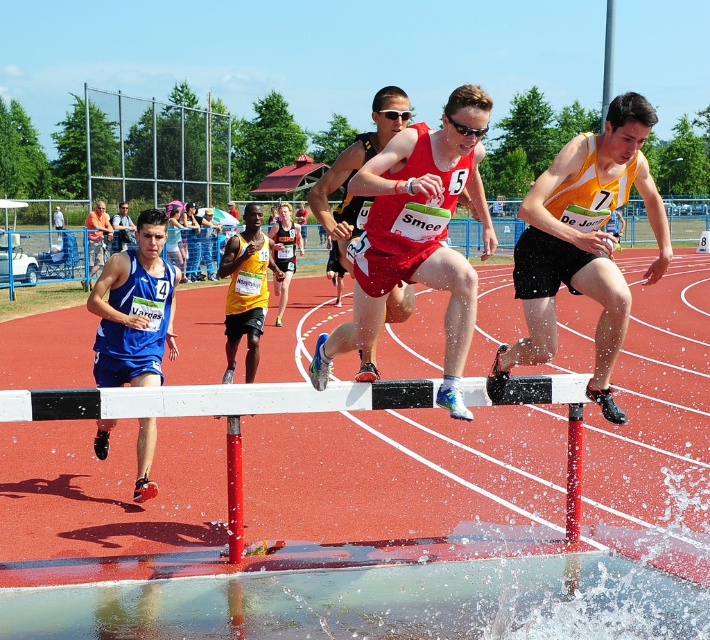
Based on the photo, you are a photographer standing at the edge of the track. You want to take a photo of the two athletes, the matte red bib at center and the blue fabric shirt at center. Which athlete will appear larger in your photo?

The matte red bib at center is closer to the viewer than the blue fabric shirt at center, so the athlete with the matte red bib at center will appear larger in the photo.

Based on the photo, you are a photographer at the track and field event. You need to capture a photo of the yellow mesh tank top at center and the blue fabric shirt at center. Based on their positions, which runner is standing closer to the camera?

The yellow mesh tank top at center is taller than the blue fabric shirt at center in the photo, indicating it is closer to the camera.